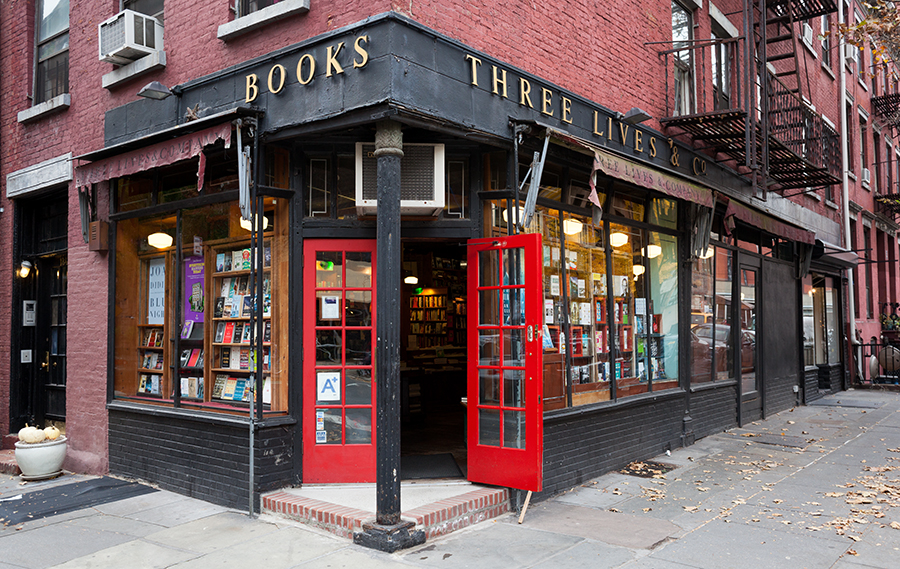
Where is `air conditioner`? Image resolution: width=900 pixels, height=569 pixels. air conditioner is located at coordinates (428, 205).